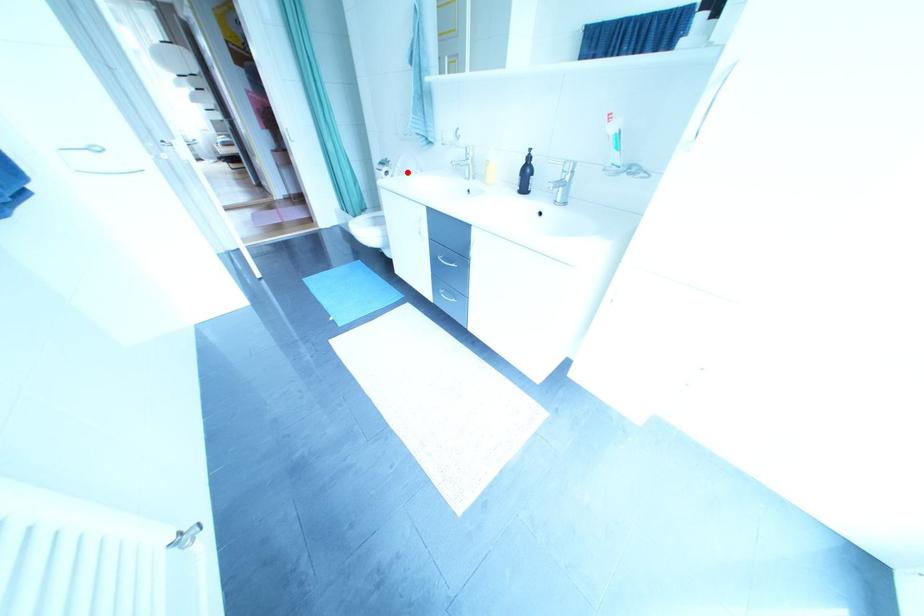
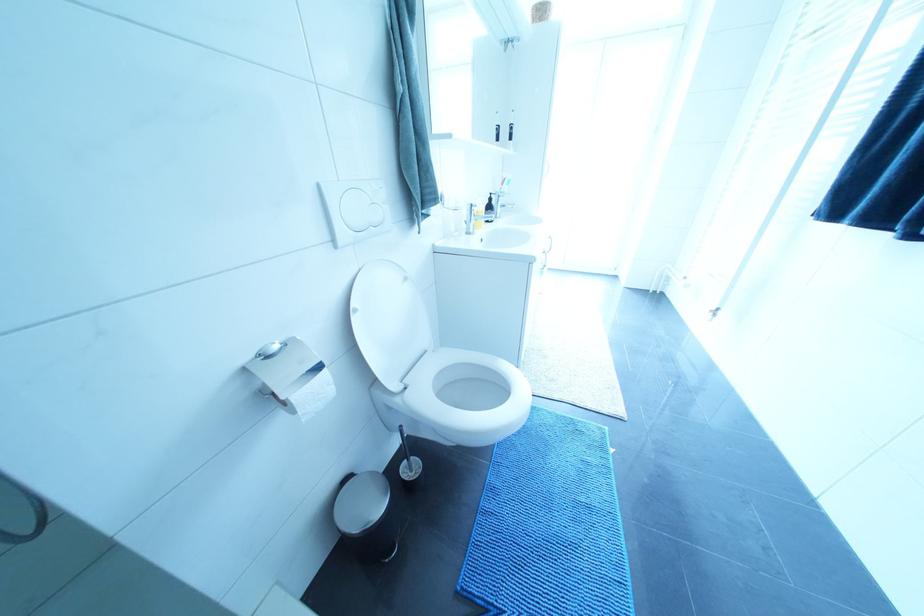
In the second image, find the point that corresponds to the highlighted location in the first image.

(367, 314)